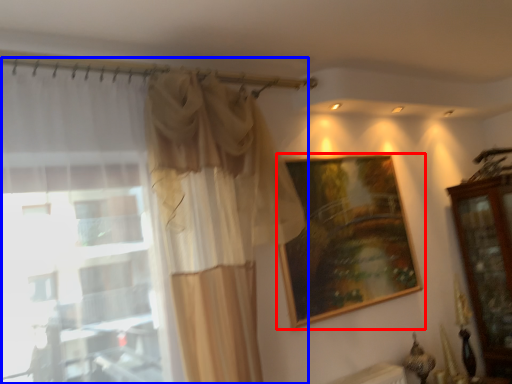
Question: Among these objects, which one is farthest to the camera, picture frame (highlighted by a red box) or curtain (highlighted by a blue box)?

Choices:
 (A) picture frame
 (B) curtain

Answer: (A)